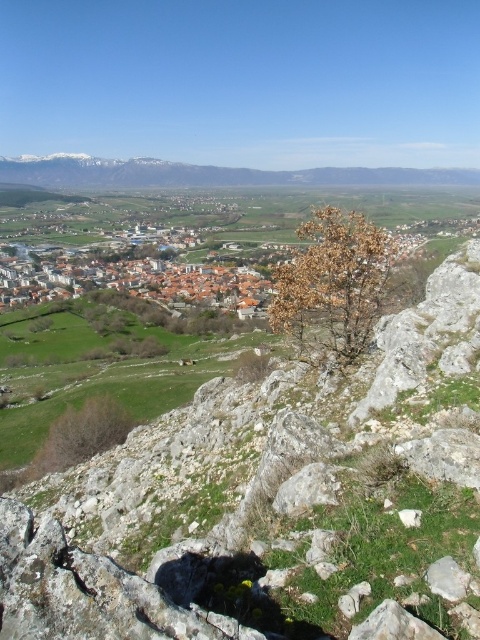
Is point (315, 442) in front of point (106, 432)?

Yes, it is.

Which is below, green grassy hill at center or brown leafless shrub at lower left?

Positioned lower is brown leafless shrub at lower left.

Which is behind, point (362, 429) or point (52, 429)?

Positioned behind is point (52, 429).

Where is `green grassy hill at center`? The image size is (480, 640). green grassy hill at center is located at coordinates (273, 500).

Can you confirm if brown leafless shrub at lower left is positioned above gray rough stone at lower right?

No.

Is point (75, 452) farther from camera compared to point (444, 596)?

Yes, point (75, 452) is behind point (444, 596).

This screenshot has height=640, width=480. What do you see at coordinates (74, 440) in the screenshot? I see `brown leafless shrub at lower left` at bounding box center [74, 440].

I want to click on brown leafless shrub at lower left, so click(x=74, y=440).

Which is more to the right, white snow-covered mountain at center or brown leafless shrub at lower left?

Positioned to the right is white snow-covered mountain at center.

Does white snow-covered mountain at center have a lesser width compared to brown leafless shrub at lower left?

No, white snow-covered mountain at center is not thinner than brown leafless shrub at lower left.

Does point (131, 170) lie behind point (112, 400)?

Yes, point (131, 170) is farther from viewer.

Locate an element on the screen. Image resolution: width=480 pixels, height=640 pixels. white snow-covered mountain at center is located at coordinates (207, 173).